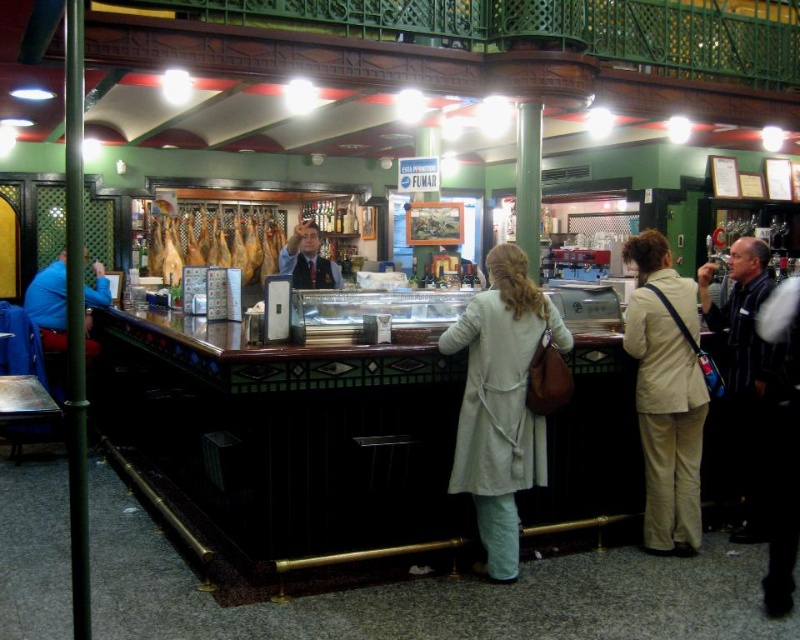
Does point (500, 314) come farther from viewer compared to point (244, 246)?

No, (500, 314) is in front of (244, 246).

At what (x,y) coordinates should I click in order to perform the action: click on light beige coat at center. Please return your answer as a coordinate pair (x, y). Looking at the image, I should click on (501, 401).

This screenshot has height=640, width=800. What are the coordinates of `light beige coat at center` in the screenshot? It's located at (501, 401).

Who is more forward, (470,419) or (652,444)?

Positioned in front is point (470,419).

Does light beige coat at center have a larger size compared to beige fabric coat at center?

Correct, light beige coat at center is larger in size than beige fabric coat at center.

Is point (528, 340) positioned after point (652, 392)?

No, (528, 340) is closer to viewer.

Locate an element on the screen. light beige coat at center is located at coordinates (501, 401).

How far apart are beige fabric coat at center and smoked ham at center?

19.66 feet

Between point (650, 364) and point (188, 237), which one is positioned in front?

Point (650, 364)

Is point (658, 342) farther from camera compared to point (208, 228)?

That is False.

Locate an element on the screen. beige fabric coat at center is located at coordinates (666, 396).